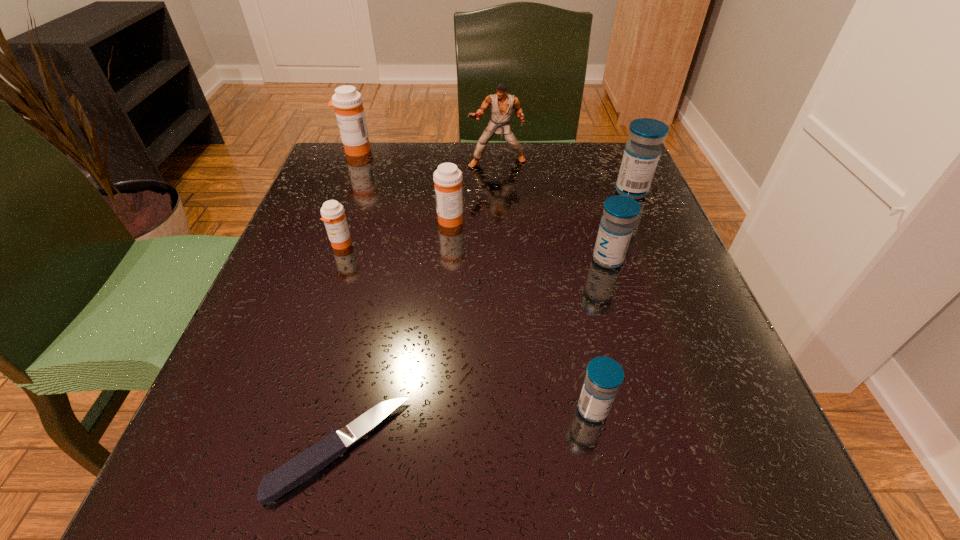
I want to click on the fourth object from right to left, so click(x=502, y=103).

In order to click on puncher in this screenshot , I will do `click(502, 103)`.

The width and height of the screenshot is (960, 540). I want to click on the farthest medicine, so click(349, 110).

Identify the location of the farthest orange medicine. (349, 110).

What are the coordinates of `the farthest blue medicine` in the screenshot? It's located at (641, 155).

Identify the location of the second farthest medicine. The width and height of the screenshot is (960, 540). (641, 155).

This screenshot has width=960, height=540. I want to click on the second farthest orange medicine, so click(x=448, y=178).

Find the location of `the fourth object from left to right`. the fourth object from left to right is located at coordinates (448, 178).

At what (x,y) coordinates should I click in order to perform the action: click on the second object from right to left. Please return your answer as a coordinate pair (x, y). The height and width of the screenshot is (540, 960). Looking at the image, I should click on (617, 224).

Identify the location of the second blue medicine from right to left. (617, 224).